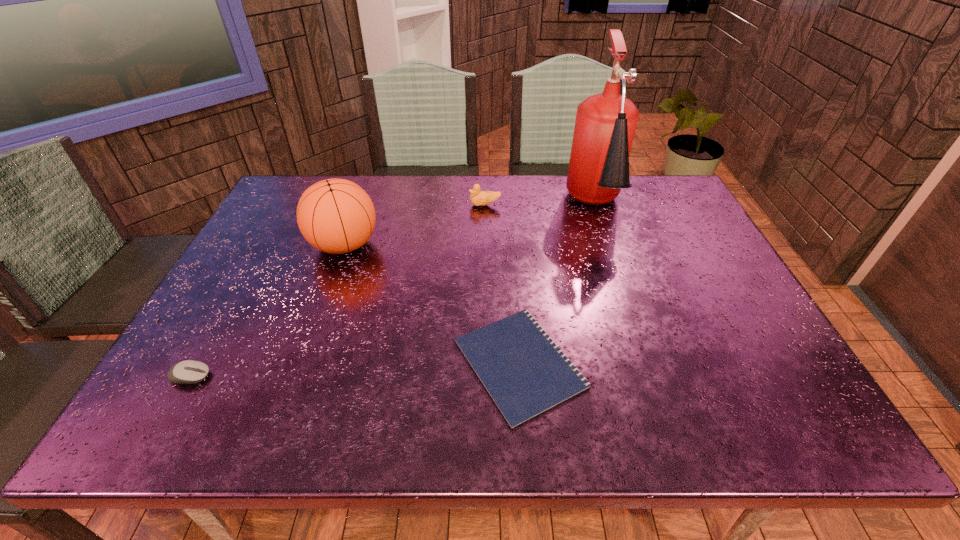
Where is `free space between the rightmost object and the second object from left to right`? free space between the rightmost object and the second object from left to right is located at coordinates (470, 226).

Identify the location of vacant area that lies between the fire extinguisher and the second object from left to right. (470, 226).

Where is `vacant space that's between the fire extinguisher and the shortest object`? The height and width of the screenshot is (540, 960). vacant space that's between the fire extinguisher and the shortest object is located at coordinates (558, 286).

The width and height of the screenshot is (960, 540). Find the location of `empty space between the fire extinguisher and the third shortest object`. empty space between the fire extinguisher and the third shortest object is located at coordinates (540, 206).

Where is `unoccupied position between the notepad and the rightmost object`? This screenshot has width=960, height=540. unoccupied position between the notepad and the rightmost object is located at coordinates (558, 286).

This screenshot has height=540, width=960. Find the location of `the third closest object to the notepad`. the third closest object to the notepad is located at coordinates (479, 198).

Find the location of `object that ranks as the fourth closest to the fourth shortest object`. object that ranks as the fourth closest to the fourth shortest object is located at coordinates (605, 125).

At what (x,y) coordinates should I click in order to perform the action: click on blank area in the image that satisfies the following two spatial constraints: 1. with the nozzle aimed from the tallest object; 2. on the wheel side of the second shortest object. Please return your answer as a coordinate pair (x, y). The image size is (960, 540). Looking at the image, I should click on (652, 376).

I want to click on vacant space that satisfies the following two spatial constraints: 1. with the nozzle aimed from the tallest object; 2. on the wheel side of the fourth tallest object, so click(652, 376).

Locate an element on the screen. This screenshot has height=540, width=960. free space that satisfies the following two spatial constraints: 1. with the nozzle aimed from the tallest object; 2. on the wheel side of the leftmost object is located at coordinates (652, 376).